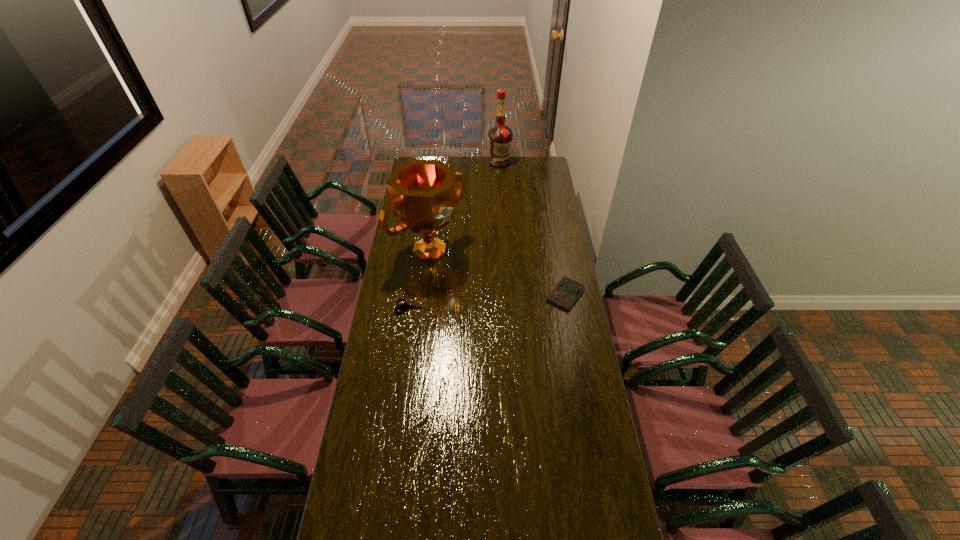
I want to click on vacant area that lies between the shears and the second object from right to left, so click(x=455, y=235).

Locate an element on the screen. This screenshot has width=960, height=540. free space between the shortest object and the third nearest object is located at coordinates (420, 279).

Locate an element on the screen. The height and width of the screenshot is (540, 960). object identified as the third closest to the second farthest object is located at coordinates (500, 136).

Locate an element on the screen. This screenshot has height=540, width=960. object that stands as the third closest to the shortest object is located at coordinates (500, 136).

I want to click on vacant space that satisfies the following two spatial constraints: 1. on the front side of the rightmost object; 2. on the right side of the award, so click(424, 294).

At what (x,y) coordinates should I click in order to perform the action: click on free point that satisfies the following two spatial constraints: 1. on the back side of the third tallest object; 2. on the right side of the shears. Please return your answer as a coordinate pair (x, y). This screenshot has width=960, height=540. Looking at the image, I should click on (412, 294).

Locate an element on the screen. The width and height of the screenshot is (960, 540). free spot that satisfies the following two spatial constraints: 1. on the front side of the farthest object; 2. on the right side of the calculator is located at coordinates (507, 294).

What are the coordinates of `free space that satisfies the following two spatial constraints: 1. on the back side of the award; 2. on the left side of the liquor` in the screenshot? It's located at (440, 163).